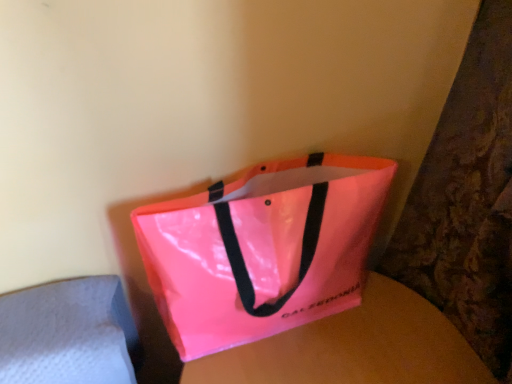
The width and height of the screenshot is (512, 384). I want to click on neon pink glossy tote bag at center, so click(x=262, y=249).

Describe the element at coordinates (262, 249) in the screenshot. I see `neon pink glossy tote bag at center` at that location.

What is the approximate width of neon pink glossy tote bag at center?

neon pink glossy tote bag at center is 6.65 inches wide.

What do you see at coordinates (355, 348) in the screenshot?
I see `pink glossy bag at center` at bounding box center [355, 348].

I want to click on pink glossy bag at center, so click(355, 348).

You are a GUI agent. You are given a task and a screenshot of the screen. Output one action in this format:
    pyautogui.click(x=<x>, y=<y>)
    Task: Click on the neon pink glossy tote bag at center
    
    Given the screenshot: What is the action you would take?
    pyautogui.click(x=262, y=249)

Which is more to the left, neon pink glossy tote bag at center or pink glossy bag at center?

neon pink glossy tote bag at center.

Between neon pink glossy tote bag at center and pink glossy bag at center, which one is positioned in front?

neon pink glossy tote bag at center is closer to the camera.

Which point is more forward, [288,237] or [289,338]?

The point [288,237] is more forward.

From the picture: From the image's perspective, is neon pink glossy tote bag at center located above or below pink glossy bag at center?

neon pink glossy tote bag at center is above pink glossy bag at center.

Consider the image. From a real-world perspective, which object stands above the other?

neon pink glossy tote bag at center is physically above.

Is neon pink glossy tote bag at center wider than pink glossy bag at center?

In fact, neon pink glossy tote bag at center might be narrower than pink glossy bag at center.

Who is shorter, neon pink glossy tote bag at center or pink glossy bag at center?

With less height is neon pink glossy tote bag at center.

Which of these two, neon pink glossy tote bag at center or pink glossy bag at center, is smaller?

neon pink glossy tote bag at center is smaller.

Is pink glossy bag at center surrounded by neon pink glossy tote bag at center?

No, pink glossy bag at center is not a part of neon pink glossy tote bag at center.

Would you consider neon pink glossy tote bag at center to be distant from pink glossy bag at center?

They are positioned close to each other.

In the scene shown: Is neon pink glossy tote bag at center facing away from pink glossy bag at center?

That's not correct — neon pink glossy tote bag at center is not looking away from pink glossy bag at center.

You are a GUI agent. You are given a task and a screenshot of the screen. Output one action in this format:
    pyautogui.click(x=<x>, y=<y>)
    Task: Click on the round table below the neon pink glossy tote bag at center (from a real-world perspective)
    
    Given the screenshot: What is the action you would take?
    pyautogui.click(x=355, y=348)

Which is more to the right, pink glossy bag at center or neon pink glossy tote bag at center?

Positioned to the right is pink glossy bag at center.

Is the position of pink glossy bag at center more distant than that of neon pink glossy tote bag at center?

Yes, pink glossy bag at center is further from the camera.

Which is behind, point (415, 321) or point (183, 261)?

Positioned behind is point (415, 321).

From the image's perspective, is pink glossy bag at center beneath neon pink glossy tote bag at center?

Yes, from the image's perspective, pink glossy bag at center is beneath neon pink glossy tote bag at center.

Looking at this image, from a real-world perspective, is pink glossy bag at center located beneath neon pink glossy tote bag at center?

Yes, from a real-world perspective, pink glossy bag at center is beneath neon pink glossy tote bag at center.

Between pink glossy bag at center and neon pink glossy tote bag at center, which one has larger width?

Wider between the two is pink glossy bag at center.

Who is taller, pink glossy bag at center or neon pink glossy tote bag at center?

With more height is pink glossy bag at center.

Does pink glossy bag at center have a smaller size compared to neon pink glossy tote bag at center?

Actually, pink glossy bag at center might be larger than neon pink glossy tote bag at center.

Is pink glossy bag at center inside the boundaries of neon pink glossy tote bag at center, or outside?

The correct answer is: outside.

Is the surface of pink glossy bag at center in direct contact with neon pink glossy tote bag at center?

No, pink glossy bag at center is not making contact with neon pink glossy tote bag at center.

Is pink glossy bag at center oriented towards neon pink glossy tote bag at center?

No.

How many degrees apart are the facing directions of pink glossy bag at center and neon pink glossy tote bag at center?

The facing directions of pink glossy bag at center and neon pink glossy tote bag at center are 88.9 degrees apart.

Identify the location of round table that appears behind the neon pink glossy tote bag at center. coord(355,348).

At what (x,y) coordinates should I click in order to perform the action: click on handbag in front of the pink glossy bag at center. Please return your answer as a coordinate pair (x, y). The height and width of the screenshot is (384, 512). Looking at the image, I should click on (262, 249).

Locate an element on the screen. The width and height of the screenshot is (512, 384). round table located on the right of neon pink glossy tote bag at center is located at coordinates (355, 348).